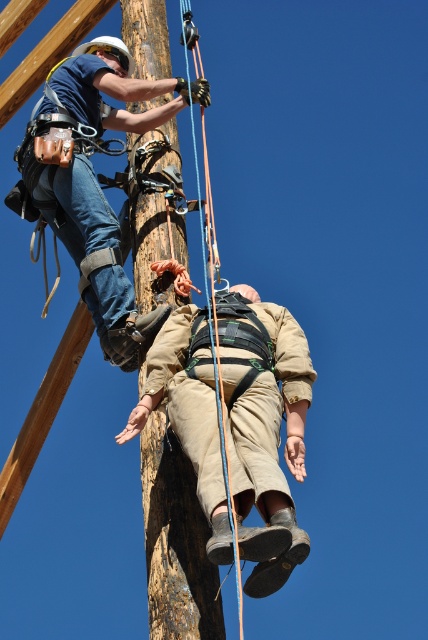
Between tan canvas pants at lower center and blue synthetic rope at center, which one has less height?

tan canvas pants at lower center

In the scene shown: Is tan canvas pants at lower center in front of blue synthetic rope at center?

No, it is not.

Between point (279, 572) and point (222, 388), which one is positioned behind?

Point (222, 388)

Where is `tan canvas pants at lower center`? This screenshot has width=428, height=640. tan canvas pants at lower center is located at coordinates (267, 436).

At what (x,y) coordinates should I click in order to perform the action: click on tan canvas pants at lower center. Please return your answer as a coordinate pair (x, y). Looking at the image, I should click on (267, 436).

Image resolution: width=428 pixels, height=640 pixels. What do you see at coordinates (267, 436) in the screenshot? I see `tan canvas pants at lower center` at bounding box center [267, 436].

Find the location of a particular element. This screenshot has height=640, width=428. tan canvas pants at lower center is located at coordinates (267, 436).

Can you confirm if matte blue shirt at upper left is taller than blue synthetic rope at center?

Incorrect, matte blue shirt at upper left's height is not larger of blue synthetic rope at center's.

Between matte blue shirt at upper left and blue synthetic rope at center, which one has less height?

Standing shorter between the two is matte blue shirt at upper left.

Which is in front, point (181, 104) or point (190, 112)?

Point (181, 104)

Where is `matte blue shirt at upper left`? This screenshot has height=640, width=428. matte blue shirt at upper left is located at coordinates (95, 177).